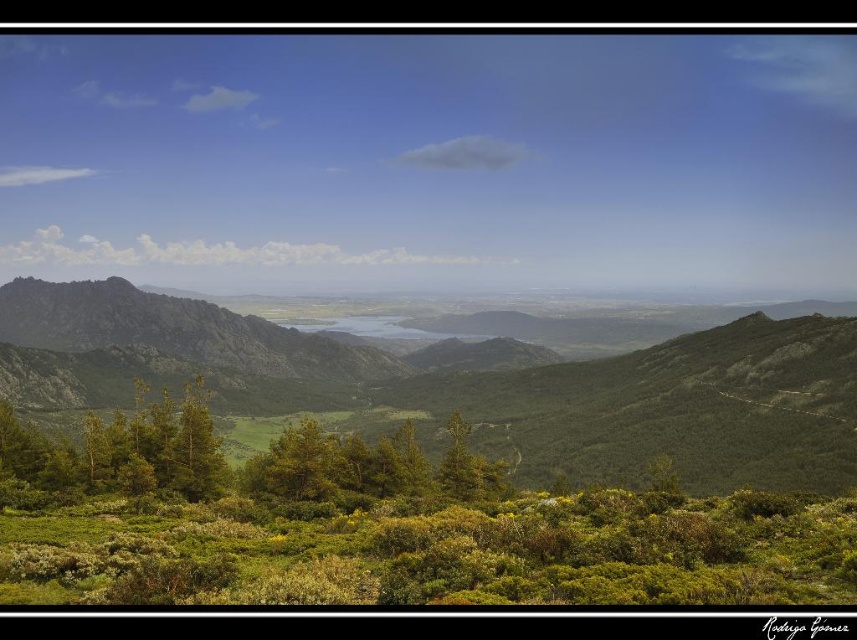
Does green textured mountain range at center have a lesser height compared to green leafy tree at center?

Incorrect, green textured mountain range at center's height does not fall short of green leafy tree at center's.

Is green textured mountain range at center taller than green leafy tree at center?

Yes, green textured mountain range at center is taller than green leafy tree at center.

Is point (115, 280) more distant than point (208, 472)?

Yes.

Identify the location of green textured mountain range at center. The image size is (857, 640). (470, 385).

This screenshot has width=857, height=640. Describe the element at coordinates (470, 385) in the screenshot. I see `green textured mountain range at center` at that location.

Which is more to the right, green textured mountain range at center or green matte tree at center?

green matte tree at center

The width and height of the screenshot is (857, 640). I want to click on green textured mountain range at center, so click(x=470, y=385).

Looking at this image, does green leafy tree at center appear on the right side of green matte tree at center?

Incorrect, green leafy tree at center is not on the right side of green matte tree at center.

In the scene shown: Can you confirm if green leafy tree at center is shorter than green matte tree at center?

Correct, green leafy tree at center is not as tall as green matte tree at center.

Does point (225, 461) come behind point (464, 435)?

No, (225, 461) is closer to viewer.

Identify the location of green leafy tree at center. This screenshot has width=857, height=640. (196, 449).